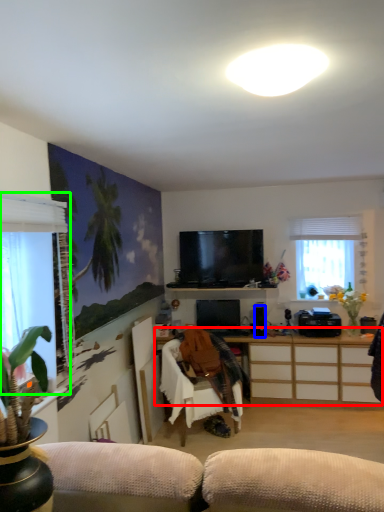
Question: Which object is the farthest from cabinetry (highlighted by a red box)? Choose among these: speaker (highlighted by a blue box) or window (highlighted by a green box).

Choices:
 (A) speaker
 (B) window

Answer: (B)